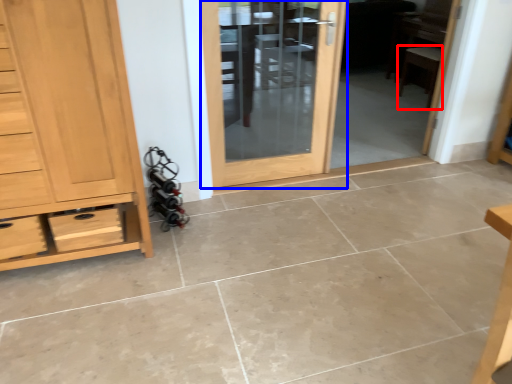
Question: Which of the following is the farthest to the observer, chair (highlighted by a red box) or door (highlighted by a blue box)?

Choices:
 (A) chair
 (B) door

Answer: (A)